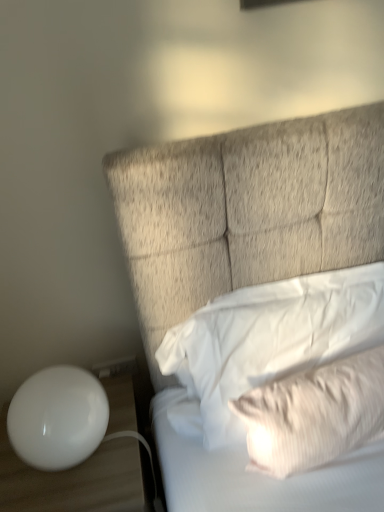
Question: From the image's perspective, is white soft pillow at upper right, arranged as the 1th pillow when viewed from the top, on top of white striped pillow at upper right, marked as the 2th pillow in a top-to-bottom arrangement?

Choices:
 (A) yes
 (B) no

Answer: (A)

Question: Does white soft pillow at upper right, the second pillow positioned from the bottom, lie in front of white striped pillow at upper right, marked as the 2th pillow in a top-to-bottom arrangement?

Choices:
 (A) no
 (B) yes

Answer: (A)

Question: Is white striped pillow at upper right, which ranks as the first pillow in bottom-to-top order, inside white soft pillow at upper right, arranged as the 1th pillow when viewed from the top?

Choices:
 (A) yes
 (B) no

Answer: (A)

Question: Is white soft pillow at upper right, arranged as the 1th pillow when viewed from the top, further to camera compared to white striped pillow at upper right, which ranks as the first pillow in bottom-to-top order?

Choices:
 (A) yes
 (B) no

Answer: (A)

Question: Considering the relative sizes of white soft pillow at upper right, arranged as the 1th pillow when viewed from the top, and white striped pillow at upper right, which ranks as the first pillow in bottom-to-top order, in the image provided, is white soft pillow at upper right, arranged as the 1th pillow when viewed from the top, smaller than white striped pillow at upper right, which ranks as the first pillow in bottom-to-top order,?

Choices:
 (A) no
 (B) yes

Answer: (A)

Question: Does white soft pillow at upper right, the second pillow positioned from the bottom, have a lesser width compared to white striped pillow at upper right, marked as the 2th pillow in a top-to-bottom arrangement?

Choices:
 (A) no
 (B) yes

Answer: (A)

Question: Does white glossy table at lower left have a greater width compared to white soft pillow at upper right, the second pillow positioned from the bottom?

Choices:
 (A) no
 (B) yes

Answer: (B)

Question: Is white glossy table at lower left far from white soft pillow at upper right, arranged as the 1th pillow when viewed from the top?

Choices:
 (A) no
 (B) yes

Answer: (A)

Question: Considering the relative positions of white glossy table at lower left and white soft pillow at upper right, arranged as the 1th pillow when viewed from the top, in the image provided, is white glossy table at lower left in front of white soft pillow at upper right, arranged as the 1th pillow when viewed from the top,?

Choices:
 (A) no
 (B) yes

Answer: (A)

Question: From a real-world perspective, is white glossy table at lower left over white soft pillow at upper right, arranged as the 1th pillow when viewed from the top?

Choices:
 (A) yes
 (B) no

Answer: (B)

Question: From the image's perspective, is white glossy table at lower left under white soft pillow at upper right, arranged as the 1th pillow when viewed from the top?

Choices:
 (A) yes
 (B) no

Answer: (A)

Question: Is white glossy table at lower left aimed at white soft pillow at upper right, arranged as the 1th pillow when viewed from the top?

Choices:
 (A) yes
 (B) no

Answer: (B)

Question: Can you confirm if white plastic electric outlet at lower left is thinner than white glossy table at lower left?

Choices:
 (A) yes
 (B) no

Answer: (A)